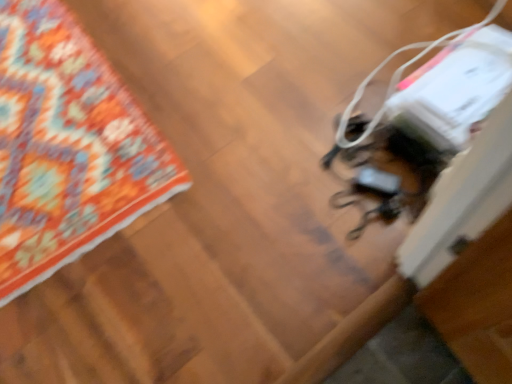
What do you see at coordinates (67, 147) in the screenshot? I see `orange patterned rug at upper left` at bounding box center [67, 147].

Locate an element on the screen. Image resolution: width=512 pixels, height=384 pixels. orange patterned rug at upper left is located at coordinates (67, 147).

The width and height of the screenshot is (512, 384). Identify the location of orange patterned rug at upper left. (67, 147).